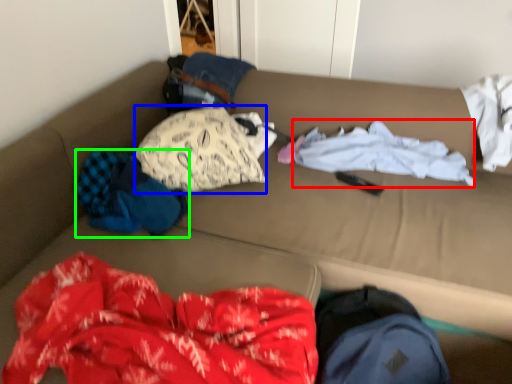
Question: Which is nearer to the clothing (highlighted by a red box)? clothing (highlighted by a blue box) or clothing (highlighted by a green box).

Choices:
 (A) clothing
 (B) clothing

Answer: (A)